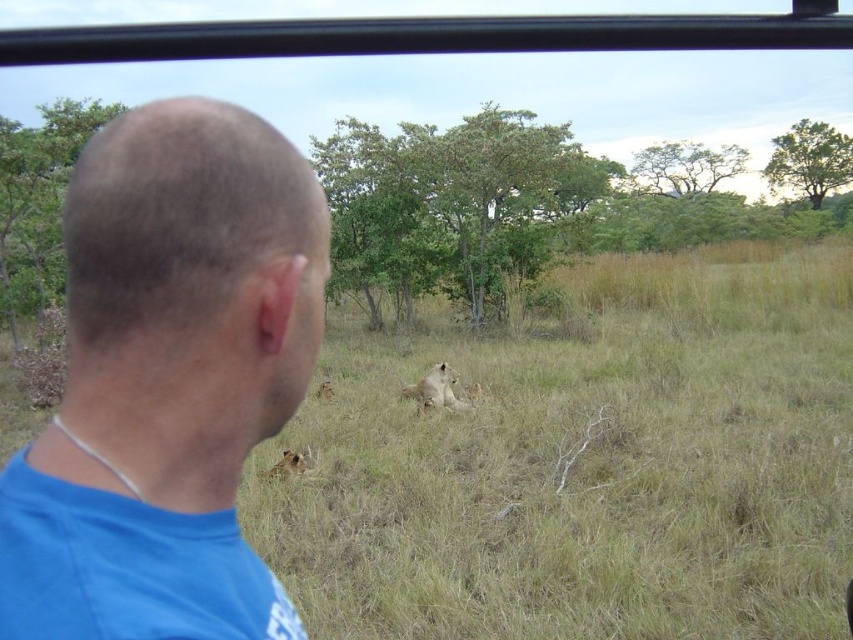
Which of these two, blue fabric shirt at left or golden fur lion at lower left, stands shorter?

Standing shorter between the two is golden fur lion at lower left.

Who is more distant from viewer, (292,172) or (305,468)?

Point (305,468)

Where is `blue fabric shirt at left`? blue fabric shirt at left is located at coordinates (167, 381).

Between green grassy at center and golden fur lion at center, which one appears on the right side from the viewer's perspective?

Positioned to the right is green grassy at center.

How much distance is there between green grassy at center and golden fur lion at center?

They are 2.74 meters apart.

Which is in front, point (467, 636) or point (421, 396)?

Point (467, 636) is in front.

Find the location of a particular element. The image size is (853, 640). green grassy at center is located at coordinates (585, 465).

Locate an element on the screen. Image resolution: width=853 pixels, height=640 pixels. green grassy at center is located at coordinates (585, 465).

You are a GUI agent. You are given a task and a screenshot of the screen. Output one action in this format:
    pyautogui.click(x=<x>, y=<y>)
    Task: Click on the green grassy at center
    
    Given the screenshot: What is the action you would take?
    pyautogui.click(x=585, y=465)